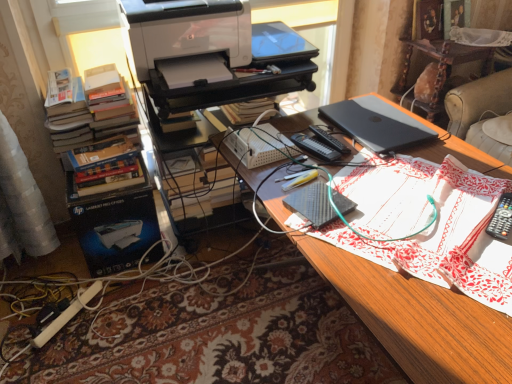
Locate an element on the screen. The width and height of the screenshot is (512, 384). free space above wooden desk at center (from a real-world perspective) is located at coordinates (395, 194).